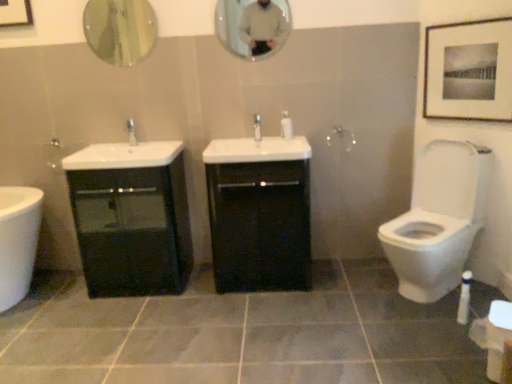
Identify the location of free space to the left of black glossy cabinet at center, the first bathroom cabinet when ordered from right to left. 189,294.